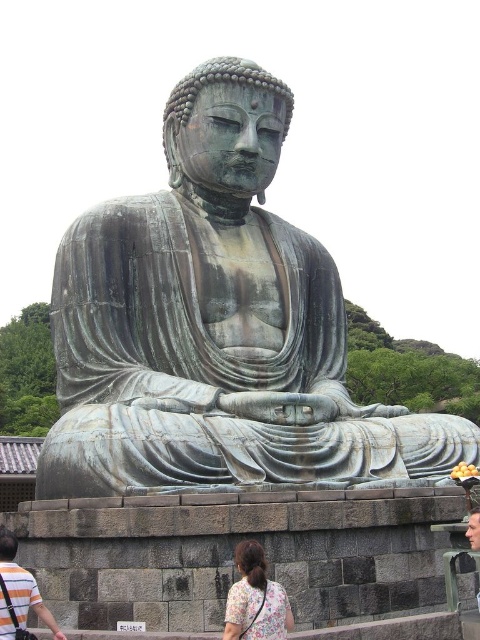
You are a visitor at a temple and want to take a photo of the green patina bronze statue at center and the floral fabric dress at lower center. Since you want both to be in the frame, can you confirm if the statue is wider than the dress?

The green patina bronze statue at center is wider than the floral fabric dress at lower center, so yes, the statue is wider than the dress.

You are a photographer trying to capture the green patina bronze statue at center and the striped cotton shirt at lower left in the same frame. Which object should you focus on first if you want to ensure both are in focus without adjusting your camera settings?

The green patina bronze statue at center is bigger than the striped cotton shirt at lower left, so focusing on the larger object first will help ensure both are in focus as it occupies more of the frame.